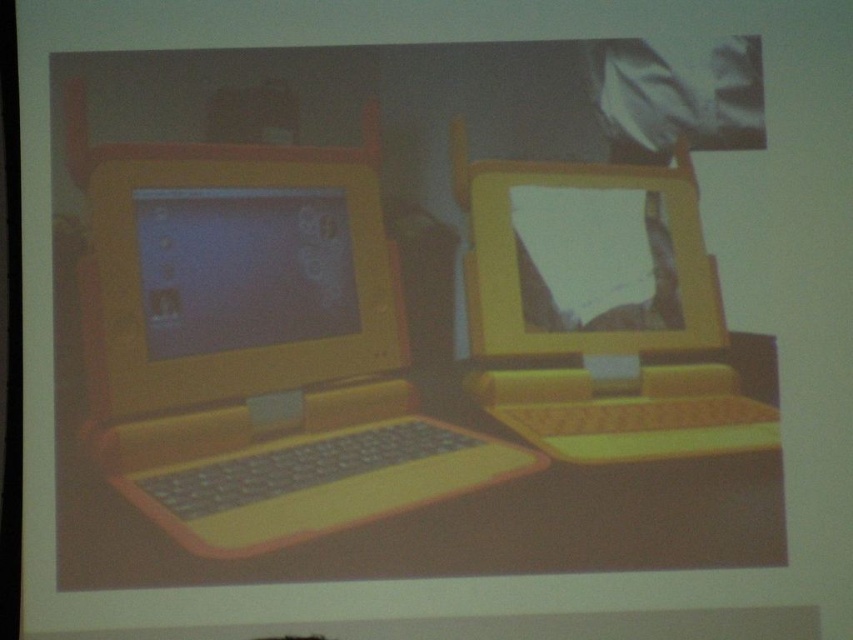
You are setting up a desk and want to place the yellow matte laptop at left and the yellow plastic monitor at center. Based on their sizes, which one should you place first to ensure stability?

The yellow matte laptop at left is taller than the yellow plastic monitor at center, so you should place the yellow plastic monitor at center first to create a stable base for the taller laptop.

You are an engineer analyzing a digital design. You need to locate the yellow matte laptop at left in the coordinate system provided. What are its coordinates?

The yellow matte laptop at left is located at coordinates point (259, 348).